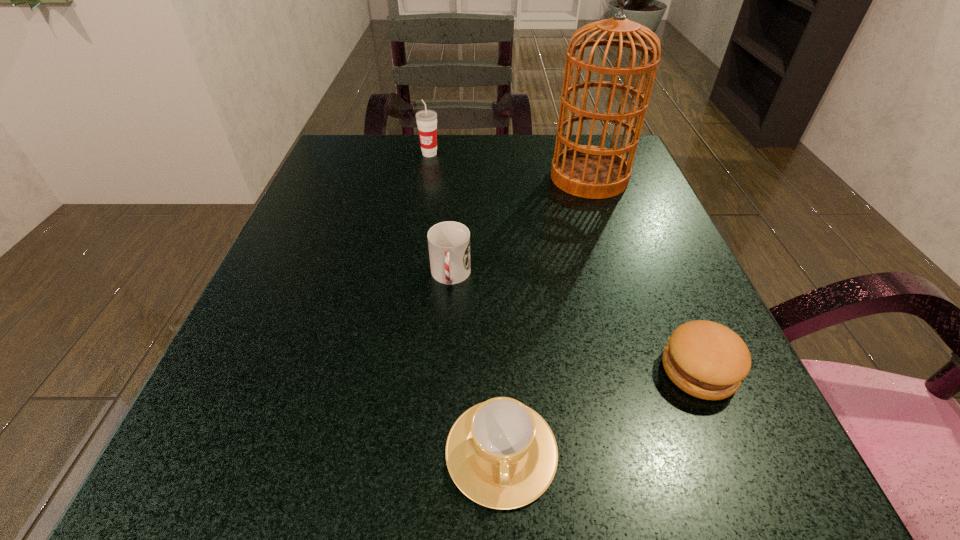
Locate an element on the screen. the tallest object is located at coordinates (x=595, y=172).

You are a GUI agent. You are given a task and a screenshot of the screen. Output one action in this format:
    pyautogui.click(x=<x>, y=<y>)
    Task: Click on the leftmost object
    This screenshot has height=540, width=960.
    Given the screenshot: What is the action you would take?
    pyautogui.click(x=426, y=120)

Identify the location of the farthest cup. The image size is (960, 540). (426, 120).

This screenshot has height=540, width=960. I want to click on the second shortest cup, so click(449, 242).

The height and width of the screenshot is (540, 960). Find the location of `the third nearest object`. the third nearest object is located at coordinates (449, 242).

Image resolution: width=960 pixels, height=540 pixels. In order to click on hamburger in this screenshot , I will do `click(707, 360)`.

The width and height of the screenshot is (960, 540). What are the coordinates of `the shortest cup` in the screenshot? It's located at (501, 454).

Identify the location of free space located 0.280m on the left of the birdcage. This screenshot has height=540, width=960. (423, 178).

This screenshot has width=960, height=540. In order to click on vacant space situated on the side of the second tallest object with the logo in this screenshot , I will do `click(418, 227)`.

Identify the location of vacant region located on the side of the third farthest object where the handle is located. (436, 492).